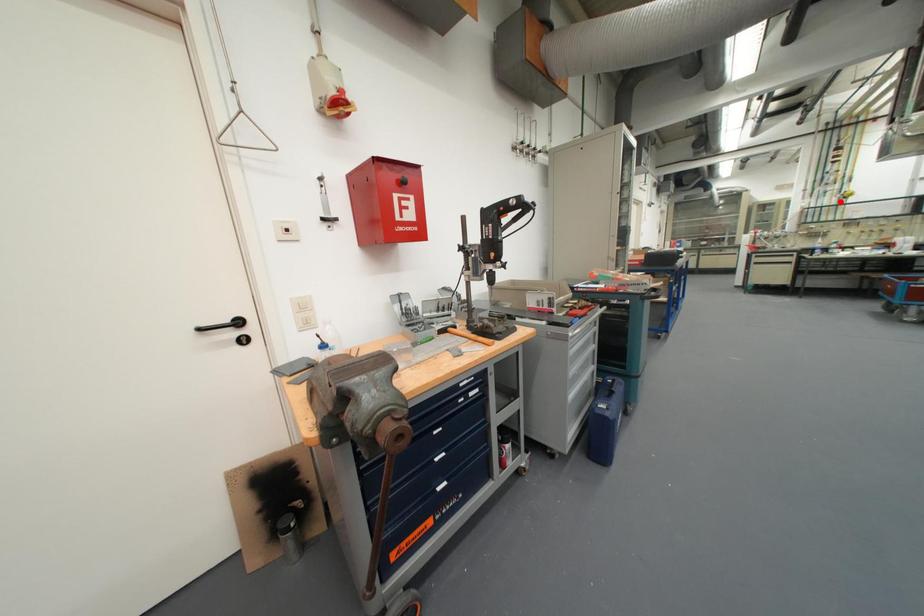
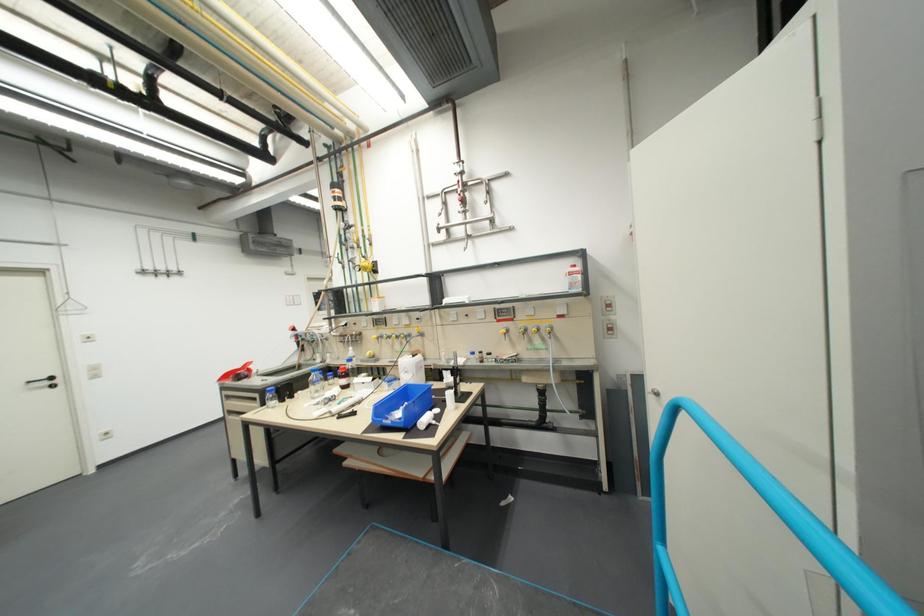
Question: I am providing you with two images of the same scene from different viewpoints. In image1, a red point is highlighted. Considering the same 3D point in image2, which of the following is correct?

Choices:
 (A) It is closer
 (B) It is farther

Answer: (A)